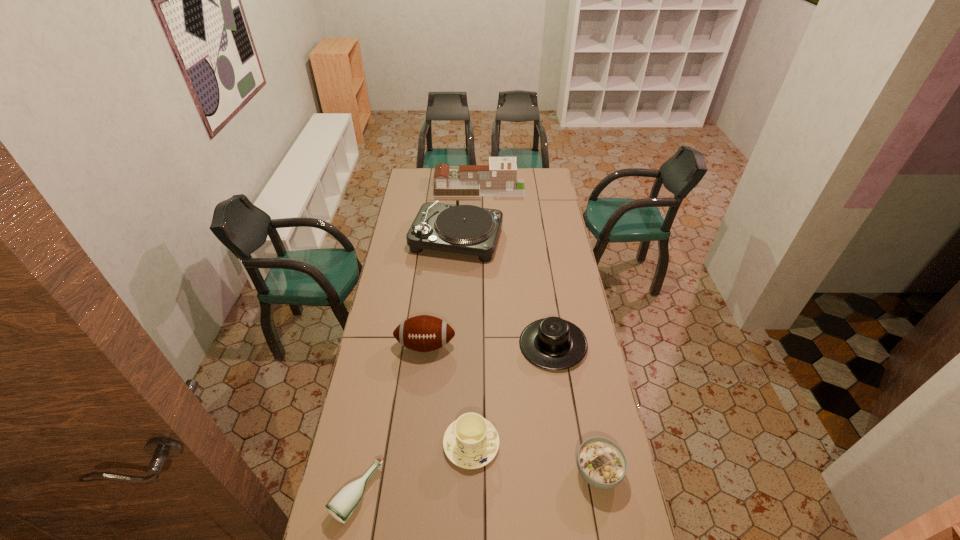
Where is `soup bowl that is at the right edge`? The width and height of the screenshot is (960, 540). soup bowl that is at the right edge is located at coordinates (601, 462).

Identify the location of vacant space at the left edge of the desktop. The image size is (960, 540). (417, 270).

Find the location of `free region at the right edge of the desktop`. free region at the right edge of the desktop is located at coordinates click(556, 286).

In order to click on free space at the far right corner of the desktop in this screenshot , I will do `click(541, 172)`.

Find the location of a particular element. This screenshot has height=540, width=960. vacant point located between the bottle and the second farthest object is located at coordinates (407, 367).

Identify the location of free space that is in between the sixth nearest object and the bottle. The image size is (960, 540). (407, 367).

The image size is (960, 540). Identify the location of vacant area that lies between the soup bowl and the chinaware. (535, 458).

Image resolution: width=960 pixels, height=540 pixels. In order to click on free space between the bottle and the dress hat in this screenshot , I will do `click(455, 419)`.

Where is `vacant space that's between the dress hat and the bottle`? vacant space that's between the dress hat and the bottle is located at coordinates (455, 419).

The height and width of the screenshot is (540, 960). I want to click on free point between the bottle and the football, so click(392, 420).